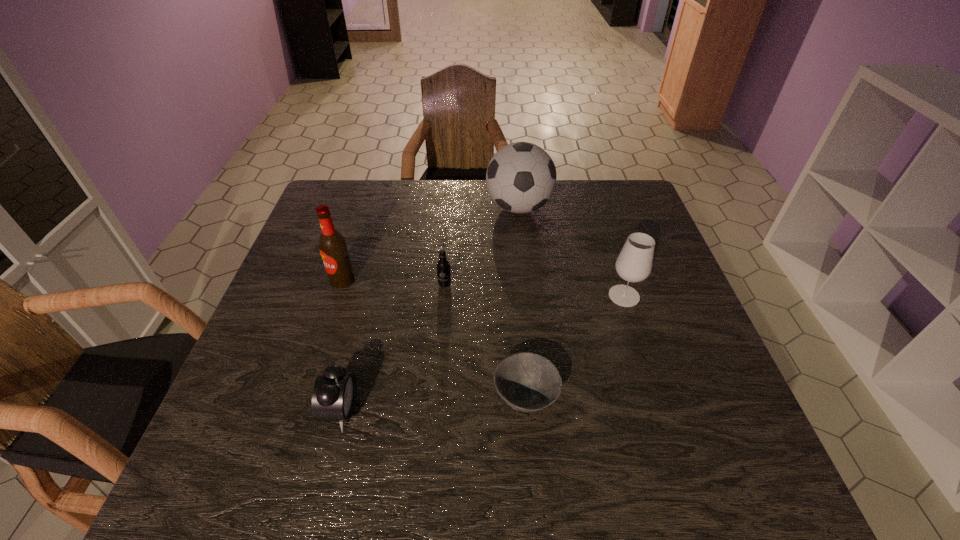
Where is `beer bottle`? beer bottle is located at coordinates click(x=333, y=248).

Identify the location of the farthest object. This screenshot has height=540, width=960. (521, 177).

Find the location of a particular element. Image resolution: width=960 pixels, height=540 pixels. glass is located at coordinates (634, 264).

You are a GUI agent. You are given a task and a screenshot of the screen. Output one action in this format:
    pyautogui.click(x=<x>, y=<y>)
    Task: Click on the fourth shortest object
    
    Given the screenshot: What is the action you would take?
    pyautogui.click(x=634, y=264)

Locate an element on the screen. This screenshot has height=540, width=960. root beer is located at coordinates pos(443,266).

Find the location of a particular element. the third object from left to right is located at coordinates (443, 266).

Where is `the fifth object from right to left`? The image size is (960, 540). the fifth object from right to left is located at coordinates (334, 395).

This screenshot has width=960, height=540. Find the location of `alarm clock`. alarm clock is located at coordinates (334, 395).

Identify the location of the shortest object. (528, 382).

Identify the location of vacant space located on the right of the beer bottle. Image resolution: width=960 pixels, height=540 pixels. (464, 280).